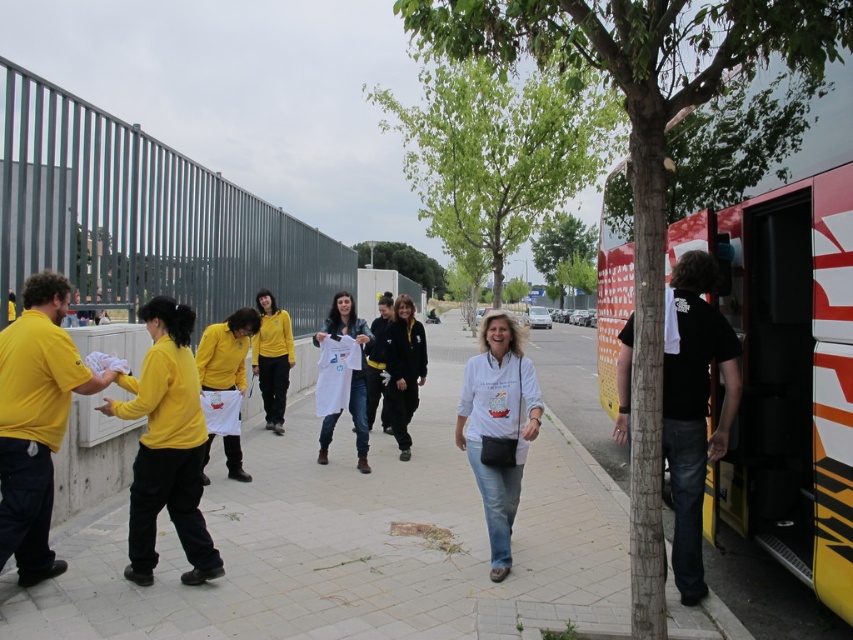
Between point (656, 113) and point (234, 452), which one is positioned behind?

The point (234, 452) is more distant.

Is yellow and red painted bus at right further to the viewer compared to matte yellow shirt at center?

No, it is not.

Does point (646, 314) come in front of point (200, 470)?

Yes.

The image size is (853, 640). What are the coordinates of `yellow and red painted bus at right` in the screenshot? It's located at (668, 180).

Is black cotton shirt at right shorter than white matte shirt at center?

No.

From the picture: Is black cotton shirt at right above white matte shirt at center?

Indeed, black cotton shirt at right is positioned over white matte shirt at center.

Looking at this image, who is more distant from viewer, (662, 428) or (527, 406)?

Point (527, 406)

At what (x,y) coordinates should I click in order to perform the action: click on black cotton shirt at right. Please return your answer as a coordinate pair (x, y). Looking at the image, I should click on (694, 410).

Is yellow and red painted bus at right shorter than white matte t-shirt at center?

Correct, yellow and red painted bus at right is not as tall as white matte t-shirt at center.

This screenshot has height=640, width=853. What are the coordinates of `yellow and red painted bus at right` in the screenshot? It's located at (668, 180).

Is point (657, 68) less distant than point (357, 336)?

That is True.

Where is `yellow and red painted bus at right`? yellow and red painted bus at right is located at coordinates (668, 180).